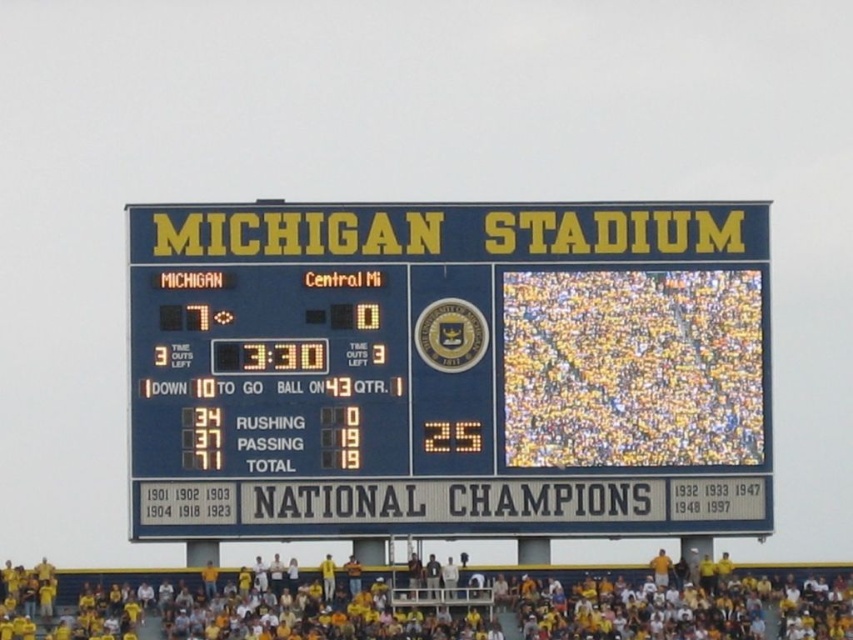
You are a spectator at Michigan Stadium and want to take a photo of the scoreboard. You notice two points on the scoreboard at coordinates point (x=189, y=230) and point (x=15, y=636). Which point will appear closer to the bottom of the photo?

Point (x=15, y=636) will appear closer to the bottom of the photo because it has a lower y coordinate than point (x=189, y=230).

You are a photographer standing at the back of the stadium. You want to take a photo of both the blue plastic scoreboard at center and the yellow fabric at lower center. Which object will appear larger in your photo?

The blue plastic scoreboard at center is closer to you than the yellow fabric at lower center, so it will appear larger in the photo.